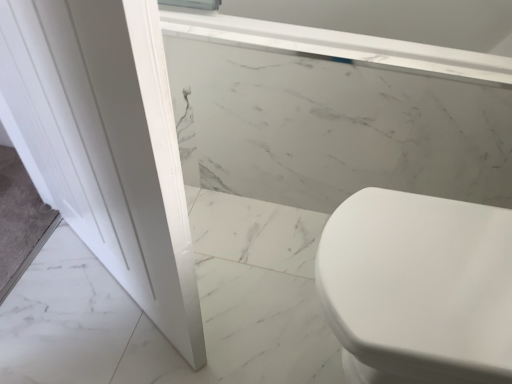
What do you see at coordinates (335, 113) in the screenshot?
I see `white marble bathtub at upper center` at bounding box center [335, 113].

Where is `white marble bathtub at upper center`? The height and width of the screenshot is (384, 512). white marble bathtub at upper center is located at coordinates (335, 113).

Where is `white marble bathtub at upper center`? The height and width of the screenshot is (384, 512). white marble bathtub at upper center is located at coordinates (335, 113).